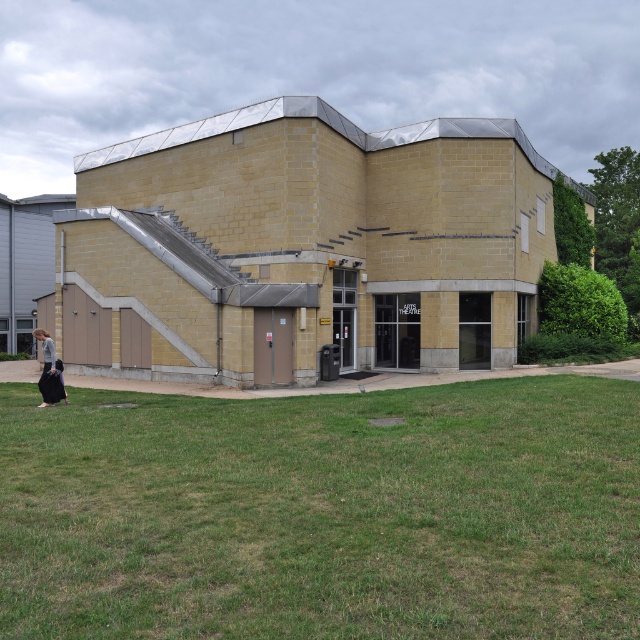
Does dark gray fabric bag at lower left appear on the right side of black fabric bag at lower left?

In fact, dark gray fabric bag at lower left is to the left of black fabric bag at lower left.

I want to click on dark gray fabric bag at lower left, so click(49, 371).

Locate an element on the screen. This screenshot has width=640, height=640. green grass at lower center is located at coordinates (323, 513).

Does point (241, 464) lie in front of point (45, 365)?

Yes.

You are a GUI agent. You are given a task and a screenshot of the screen. Output one action in this format:
    pyautogui.click(x=<x>, y=<y>)
    Task: Click on the green grass at lower center
    This screenshot has width=640, height=640.
    Given the screenshot: What is the action you would take?
    pyautogui.click(x=323, y=513)

Which is below, green grass at lower center or dark gray fabric bag at lower left?

green grass at lower center is below.

From the picture: Is green grass at lower center closer to camera compared to dark gray fabric bag at lower left?

Yes, green grass at lower center is closer to the viewer.

Is point (458, 630) more distant than point (51, 384)?

No.

Identify the location of green grass at lower center. (323, 513).